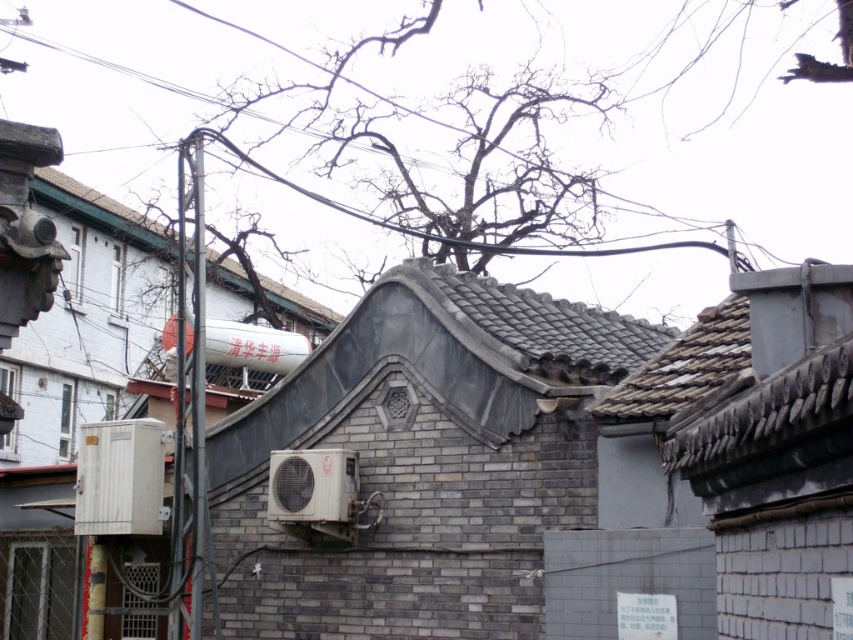
Question: Considering the real-world distances, which object is farthest from the gray tile roof at upper center?

Choices:
 (A) gray tile roof at center
 (B) black wire at upper center

Answer: (A)

Question: Which point is farther to the camera?

Choices:
 (A) gray tile roof at upper center
 (B) smooth metallic pole at left

Answer: (A)

Question: Is gray tile roof at center below smooth metallic pole at left?

Choices:
 (A) yes
 (B) no

Answer: (B)

Question: Can you confirm if gray tile roof at center is wider than gray tile roof at upper center?

Choices:
 (A) no
 (B) yes

Answer: (A)

Question: Is smooth metallic pole at left closer to camera compared to gray tile roof at upper center?

Choices:
 (A) no
 (B) yes

Answer: (B)

Question: Among these points, which one is farthest from the camera?

Choices:
 (A) (682, 220)
 (B) (265, 282)
 (C) (572, 321)
 (D) (196, 458)

Answer: (A)